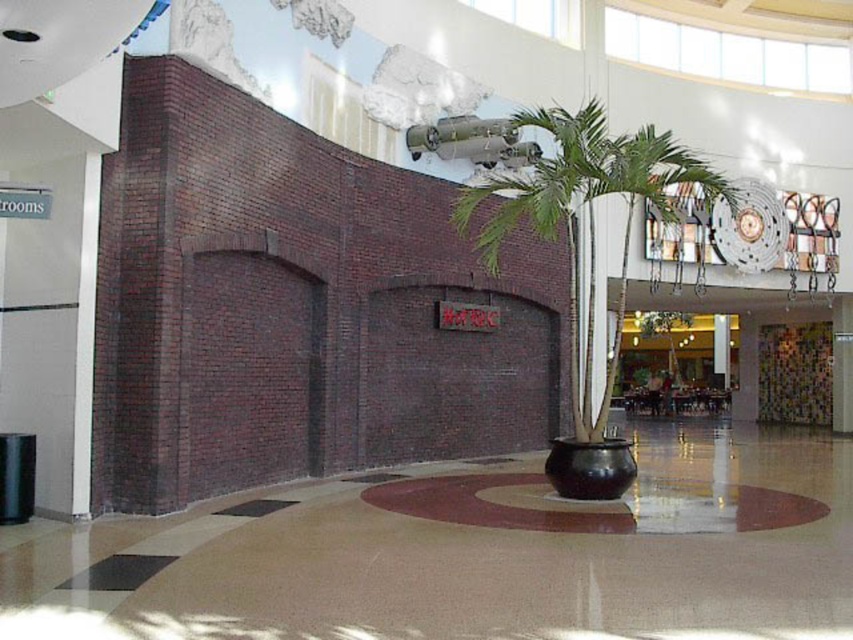
Is point (575, 196) positioned before point (498, 492)?

That is False.

Where is `green glossy palm tree at center`? The height and width of the screenshot is (640, 853). green glossy palm tree at center is located at coordinates (584, 257).